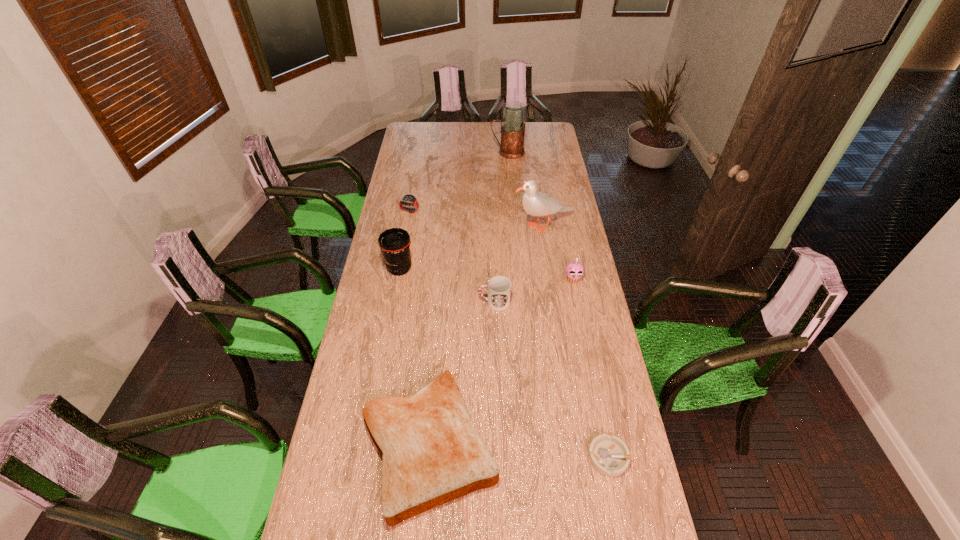
The image size is (960, 540). I want to click on free spot between the telephoto lens and the shortest object, so click(x=504, y=363).

The image size is (960, 540). What are the coordinates of `object that is the third closest to the cupcake` in the screenshot? It's located at (431, 452).

Select which object appears as the seventh closest to the ashtray. Please provide its 2D coordinates. Your answer should be formatted as a tuple, i.e. [(x, y)], where the tuple contains the x and y coordinates of a point satisfying the conditions above.

[(513, 128)]

Where is `vacant space that satisfies the following two spatial constraints: 1. on the back side of the ashtray; 2. at the beak of the gull`? vacant space that satisfies the following two spatial constraints: 1. on the back side of the ashtray; 2. at the beak of the gull is located at coordinates (563, 226).

Identify the location of free point that satisfies the following two spatial constraints: 1. with the handle on the side of the pitcher; 2. on the right side of the shortest object. (533, 457).